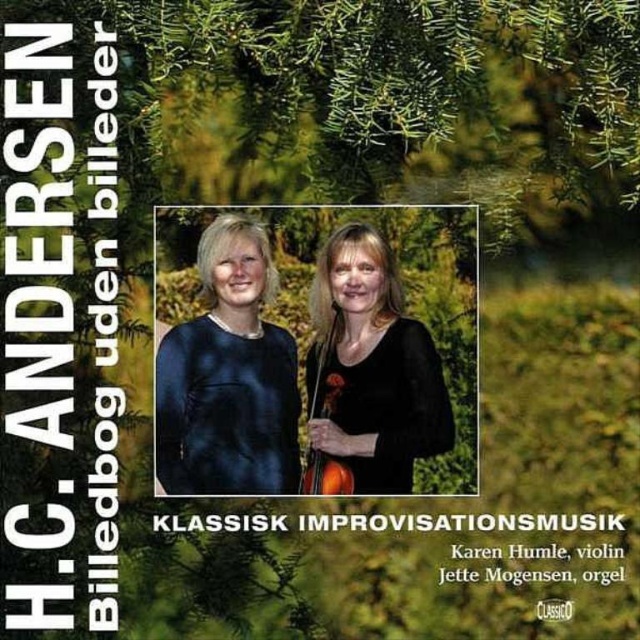
Question: In this image, where is matte black dress at center located relative to black matte dress at center?

Choices:
 (A) below
 (B) above

Answer: (B)

Question: Which of the following is the closest to the observer?

Choices:
 (A) black matte dress at center
 (B) matte black dress at center

Answer: (B)

Question: Is matte black dress at center to the right of black matte dress at center from the viewer's perspective?

Choices:
 (A) no
 (B) yes

Answer: (A)

Question: Which of the following is the closest to the observer?

Choices:
 (A) black matte dress at center
 (B) matte black dress at center

Answer: (B)

Question: Can you confirm if matte black dress at center is positioned above black matte dress at center?

Choices:
 (A) yes
 (B) no

Answer: (A)